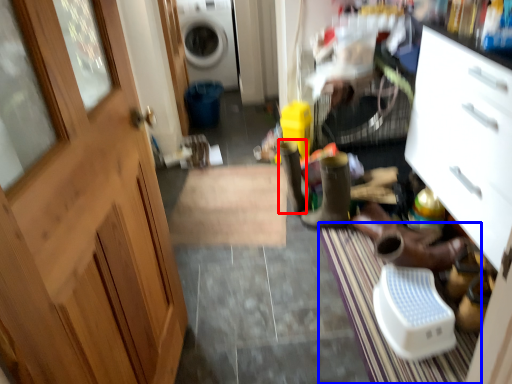
Question: Among these objects, which one is farthest to the camera, boot (highlighted by a red box) or doormat (highlighted by a blue box)?

Choices:
 (A) boot
 (B) doormat

Answer: (A)